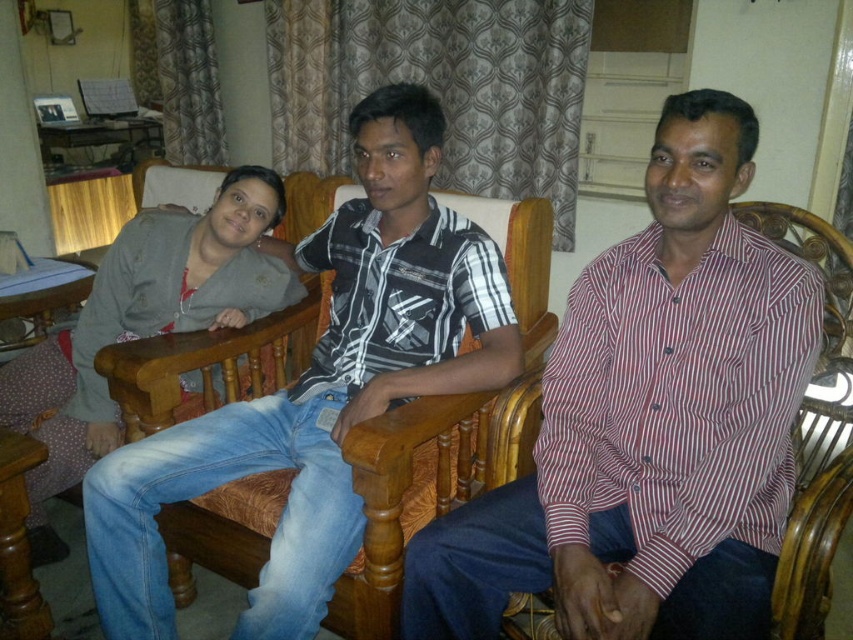
Question: Does striped cotton shirt at center come behind matte gray sweater at left?

Choices:
 (A) no
 (B) yes

Answer: (A)

Question: Among these objects, which one is nearest to the camera?

Choices:
 (A) striped cotton shirt at center
 (B) striped cotton shirt at right

Answer: (B)

Question: Is the position of striped cotton shirt at center less distant than that of matte gray sweater at left?

Choices:
 (A) yes
 (B) no

Answer: (A)

Question: Can you confirm if striped cotton shirt at right is positioned to the left of striped cotton shirt at center?

Choices:
 (A) no
 (B) yes

Answer: (A)

Question: Among these points, which one is farthest from the camera?

Choices:
 (A) (244, 212)
 (B) (624, 477)

Answer: (A)

Question: Which is nearer to the striped cotton shirt at center?

Choices:
 (A) matte gray sweater at left
 (B) striped cotton shirt at right

Answer: (B)